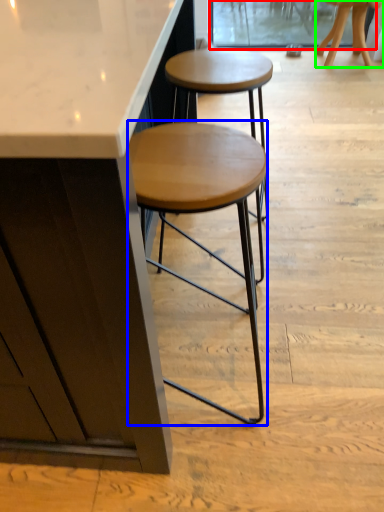
Question: Which object is positioned farthest from screen door (highlighted by a red box)? Select from stool (highlighted by a blue box) and stool (highlighted by a green box).

Choices:
 (A) stool
 (B) stool

Answer: (A)